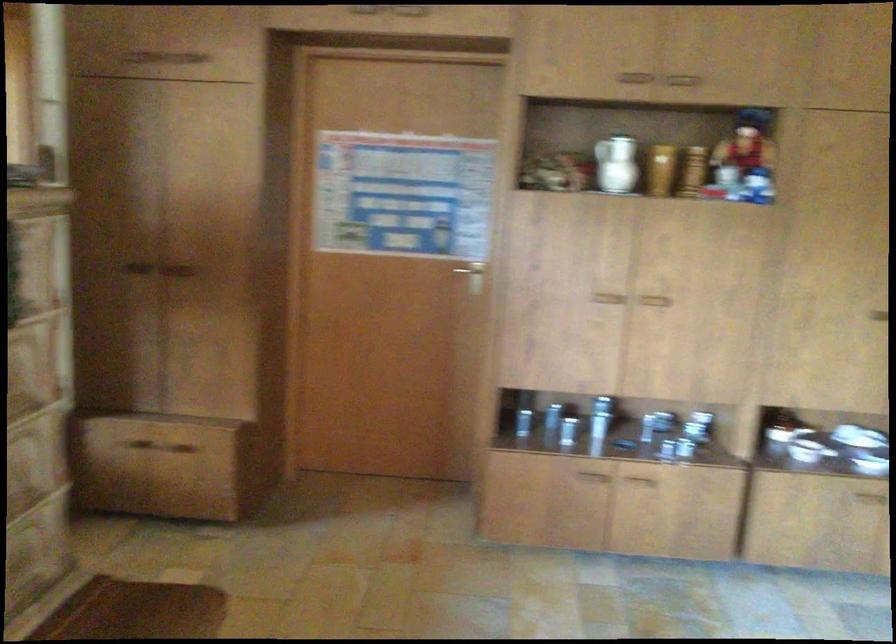
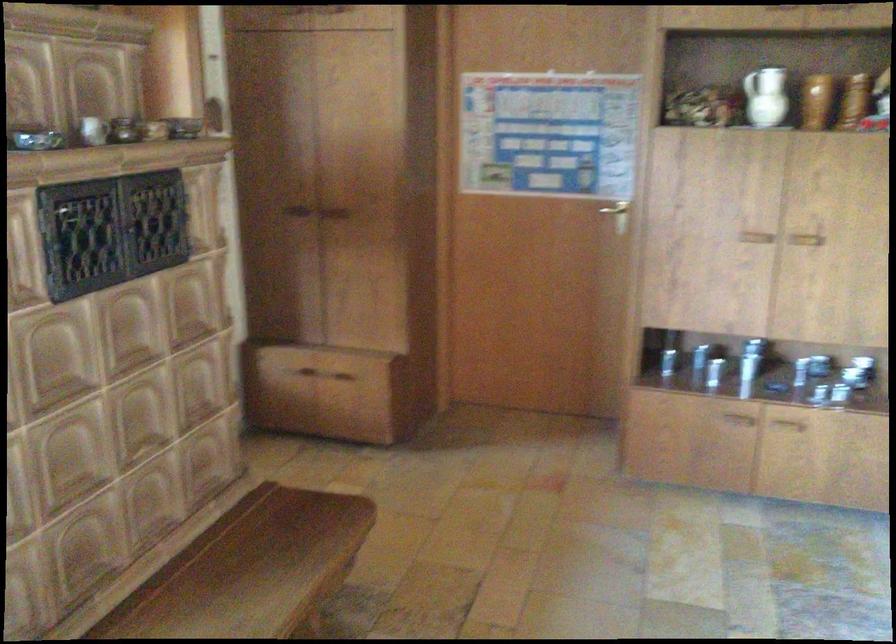
The point at (615, 165) is marked in the first image. Where is the corresponding point in the second image?

(764, 96)